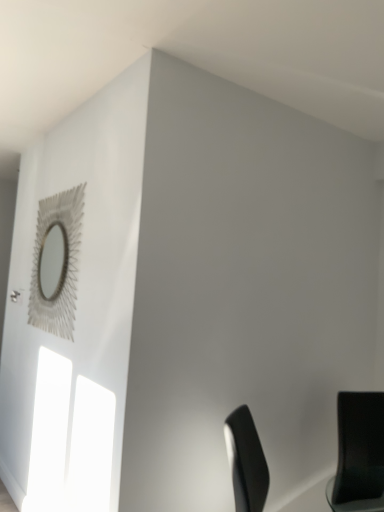
Question: Does black matte chair at lower right have a smaller size compared to metallic silver mirror at upper left?

Choices:
 (A) no
 (B) yes

Answer: (A)

Question: Considering the relative sizes of black matte chair at lower right and metallic silver mirror at upper left in the image provided, is black matte chair at lower right taller than metallic silver mirror at upper left?

Choices:
 (A) no
 (B) yes

Answer: (A)

Question: Is black matte chair at lower right not close to metallic silver mirror at upper left?

Choices:
 (A) no
 (B) yes

Answer: (B)

Question: Is black matte chair at lower right looking in the opposite direction of metallic silver mirror at upper left?

Choices:
 (A) yes
 (B) no

Answer: (B)

Question: Considering the relative sizes of black matte chair at lower right and metallic silver mirror at upper left in the image provided, is black matte chair at lower right shorter than metallic silver mirror at upper left?

Choices:
 (A) no
 (B) yes

Answer: (B)

Question: Is black matte chair at lower right not within metallic silver mirror at upper left?

Choices:
 (A) yes
 (B) no

Answer: (A)

Question: Considering the relative sizes of metallic silver mirror at upper left and black matte chair at lower right in the image provided, is metallic silver mirror at upper left smaller than black matte chair at lower right?

Choices:
 (A) no
 (B) yes

Answer: (B)

Question: Is metallic silver mirror at upper left positioned beyond the bounds of black matte chair at lower right?

Choices:
 (A) no
 (B) yes

Answer: (B)

Question: Is metallic silver mirror at upper left wider than black matte chair at lower right?

Choices:
 (A) yes
 (B) no

Answer: (B)

Question: From the image's perspective, would you say metallic silver mirror at upper left is shown under black matte chair at lower right?

Choices:
 (A) no
 (B) yes

Answer: (A)

Question: From a real-world perspective, is metallic silver mirror at upper left over black matte chair at lower right?

Choices:
 (A) no
 (B) yes

Answer: (B)

Question: Is metallic silver mirror at upper left positioned before black matte chair at lower right?

Choices:
 (A) no
 (B) yes

Answer: (A)

Question: Would you say black matte chair at lower right is inside or outside metallic silver mirror at upper left?

Choices:
 (A) outside
 (B) inside

Answer: (A)